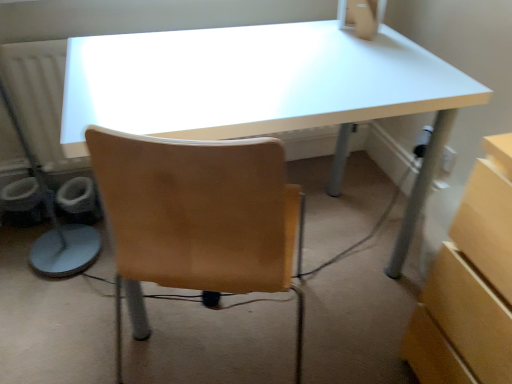
At what (x,y) coordinates should I click in order to perform the action: click on matte beige desktop computer at upper center. Please return your answer as a coordinate pair (x, y). The image size is (512, 384). Looking at the image, I should click on (361, 16).

This screenshot has height=384, width=512. What do you see at coordinates (361, 16) in the screenshot?
I see `matte beige desktop computer at upper center` at bounding box center [361, 16].

Locate an element on the screen. This screenshot has width=512, height=384. white glossy desk at center is located at coordinates (263, 90).

This screenshot has height=384, width=512. What do you see at coordinates (263, 90) in the screenshot?
I see `white glossy desk at center` at bounding box center [263, 90].

I want to click on matte beige desktop computer at upper center, so click(361, 16).

Can you confirm if matte beige desktop computer at upper center is positioned to the left of white glossy desk at center?

Incorrect, matte beige desktop computer at upper center is not on the left side of white glossy desk at center.

Is the depth of matte beige desktop computer at upper center less than that of white glossy desk at center?

No.

Which is behind, point (372, 34) or point (297, 87)?

The point (372, 34) is farther.

From the image's perspective, between matte beige desktop computer at upper center and white glossy desk at center, which one is located above?

matte beige desktop computer at upper center is shown above in the image.

From a real-world perspective, which is physically below, matte beige desktop computer at upper center or white glossy desk at center?

From a 3D spatial view, white glossy desk at center is below.

Can you confirm if matte beige desktop computer at upper center is thinner than white glossy desk at center?

Indeed, matte beige desktop computer at upper center has a lesser width compared to white glossy desk at center.

Can you confirm if matte beige desktop computer at upper center is taller than white glossy desk at center?

No, matte beige desktop computer at upper center is not taller than white glossy desk at center.

Does matte beige desktop computer at upper center have a smaller size compared to white glossy desk at center?

Indeed, matte beige desktop computer at upper center has a smaller size compared to white glossy desk at center.

From the picture: Is matte beige desktop computer at upper center positioned beyond the bounds of white glossy desk at center?

Yes, matte beige desktop computer at upper center is not within white glossy desk at center.

Would you say matte beige desktop computer at upper center is a long distance from white glossy desk at center?

No, matte beige desktop computer at upper center is in close proximity to white glossy desk at center.

From the picture: Is matte beige desktop computer at upper center aimed at white glossy desk at center?

No, matte beige desktop computer at upper center is not turned towards white glossy desk at center.

Where is `desktop computer on the right of white glossy desk at center`? This screenshot has width=512, height=384. desktop computer on the right of white glossy desk at center is located at coordinates [x=361, y=16].

In the scene shown: Considering the relative positions of white glossy desk at center and matte beige desktop computer at upper center in the image provided, is white glossy desk at center to the left or to the right of matte beige desktop computer at upper center?

Based on their positions, white glossy desk at center is located to the left of matte beige desktop computer at upper center.

Looking at this image, is the depth of white glossy desk at center less than that of matte beige desktop computer at upper center?

Yes, the depth of white glossy desk at center is less than that of matte beige desktop computer at upper center.

Does point (211, 39) lie behind point (349, 7)?

No, it is not.

From the image's perspective, would you say white glossy desk at center is shown under matte beige desktop computer at upper center?

Yes.

From a real-world perspective, who is located higher, white glossy desk at center or matte beige desktop computer at upper center?

In real-world perspective, matte beige desktop computer at upper center is above.

Considering the relative sizes of white glossy desk at center and matte beige desktop computer at upper center in the image provided, is white glossy desk at center wider than matte beige desktop computer at upper center?

Indeed, white glossy desk at center has a greater width compared to matte beige desktop computer at upper center.

Considering the sizes of objects white glossy desk at center and matte beige desktop computer at upper center in the image provided, who is taller, white glossy desk at center or matte beige desktop computer at upper center?

Standing taller between the two is white glossy desk at center.

Who is bigger, white glossy desk at center or matte beige desktop computer at upper center?

With larger size is white glossy desk at center.

Is white glossy desk at center positioned beyond the bounds of matte beige desktop computer at upper center?

white glossy desk at center is positioned outside matte beige desktop computer at upper center.

Consider the image. Is white glossy desk at center far away from matte beige desktop computer at upper center?

They are positioned close to each other.

Is white glossy desk at center turned away from matte beige desktop computer at upper center?

That's not correct — white glossy desk at center is not looking away from matte beige desktop computer at upper center.

What's the angular difference between white glossy desk at center and matte beige desktop computer at upper center's facing directions?

The facing directions of white glossy desk at center and matte beige desktop computer at upper center are 142 degrees apart.

Where is `desktop computer that is above the white glossy desk at center (from the image's perspective)`? desktop computer that is above the white glossy desk at center (from the image's perspective) is located at coordinates (361, 16).

Locate an element on the screen. The width and height of the screenshot is (512, 384). desk that is on the left side of matte beige desktop computer at upper center is located at coordinates (263, 90).

I want to click on desktop computer located above the white glossy desk at center (from a real-world perspective), so click(361, 16).